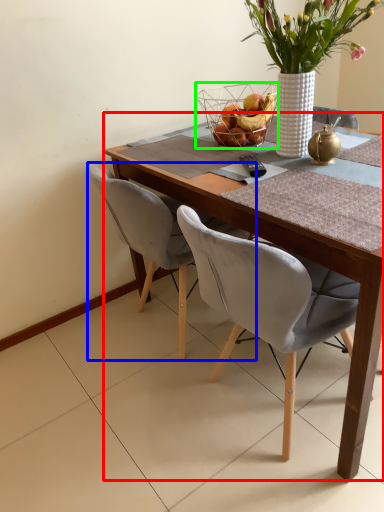
Question: Which object is the closest to the round table (highlighted by a red box)? Choose among these: chair (highlighted by a blue box) or basket (highlighted by a green box).

Choices:
 (A) chair
 (B) basket

Answer: (A)